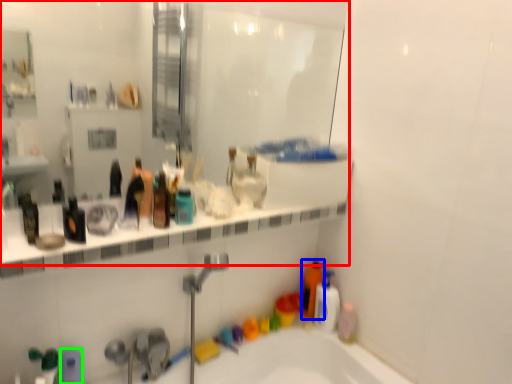
Question: Based on their relative distances, which object is nearer to mirror (highlighted by a red box)? Choose from cleaning product (highlighted by a blue box) and toiletry (highlighted by a green box).

Choices:
 (A) cleaning product
 (B) toiletry

Answer: (A)